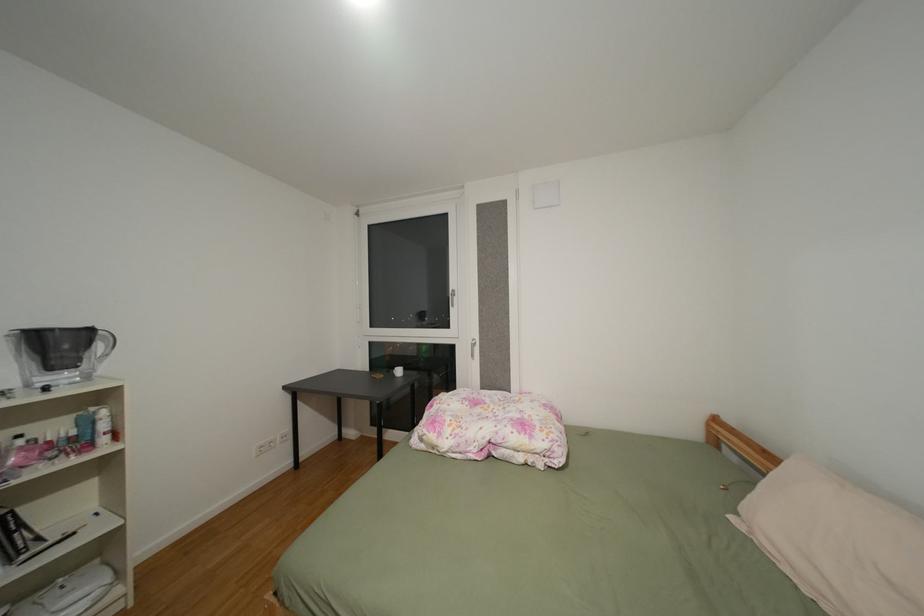
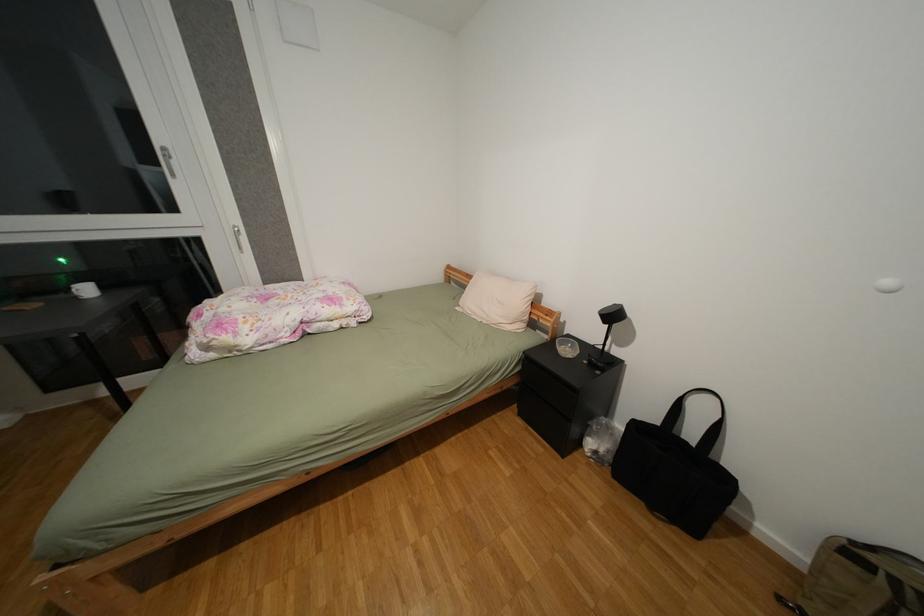
The images are taken continuously from a first-person perspective. In which direction is your viewpoint rotating?

The camera rotated toward right-down.